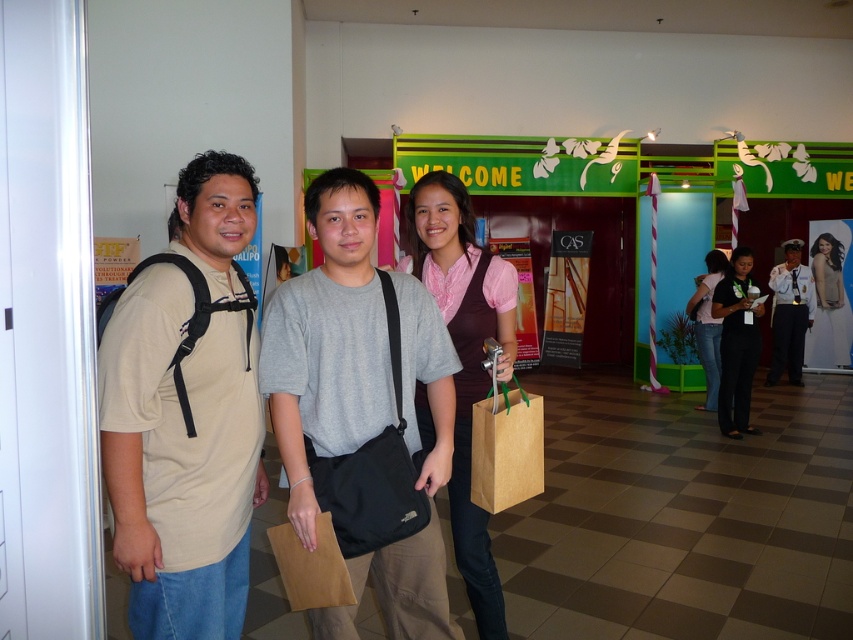
Which is below, matte gray shirt at center or matte pink shirt at right?

matte gray shirt at center

Consider the image. Does matte gray shirt at center have a lesser height compared to matte pink shirt at right?

Indeed, matte gray shirt at center has a lesser height compared to matte pink shirt at right.

From the picture: Measure the distance between matte gray shirt at center and camera.

They are 1.49 meters apart.

You are a GUI agent. You are given a task and a screenshot of the screen. Output one action in this format:
    pyautogui.click(x=<x>, y=<y>)
    Task: Click on the matte gray shirt at center
    
    Given the screenshot: What is the action you would take?
    pyautogui.click(x=410, y=584)

In the scene shown: Who is taller, dark gray uniform at right or light beige fabric dress at center?

dark gray uniform at right

Is dark gray uniform at right shorter than light beige fabric dress at center?

Incorrect, dark gray uniform at right's height does not fall short of light beige fabric dress at center's.

Which is behind, point (811, 278) or point (840, 340)?

Positioned behind is point (840, 340).

The height and width of the screenshot is (640, 853). Find the location of `dark gray uniform at right`. dark gray uniform at right is located at coordinates (788, 314).

Consider the image. Who is more forward, (375, 576) or (361, 268)?

Point (361, 268) is more forward.

Is gray fabric bag at center shorter than matte gray shirt at center?

No.

Describe the element at coordinates (360, 392) in the screenshot. The image size is (853, 640). I see `gray fabric bag at center` at that location.

Where is `gray fabric bag at center`? The width and height of the screenshot is (853, 640). gray fabric bag at center is located at coordinates (360, 392).